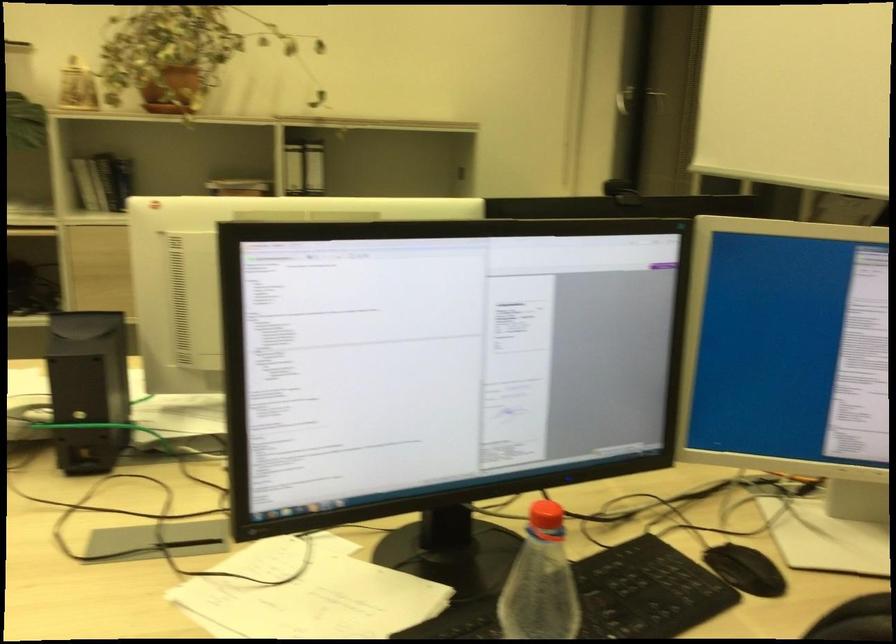
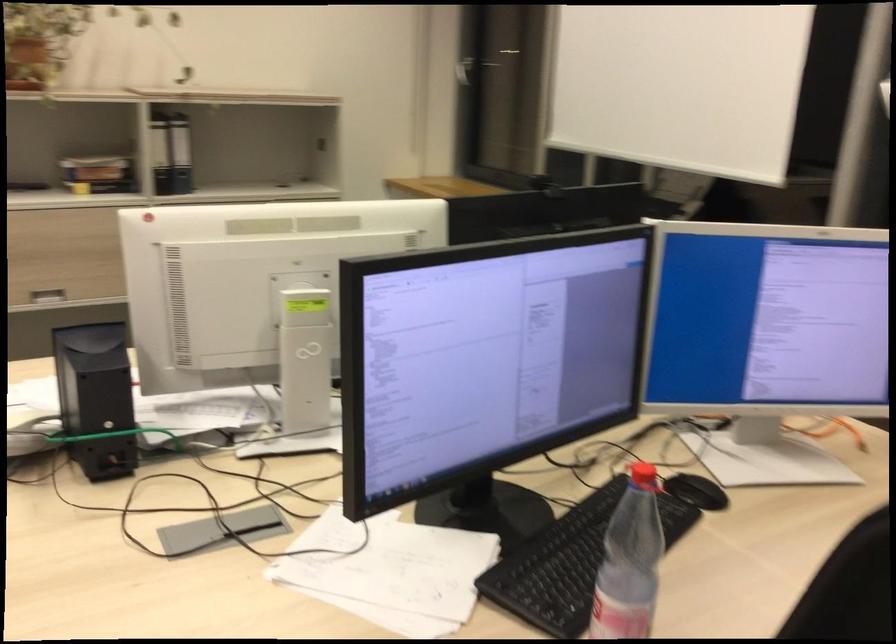
Where in the second image is the point corresponding to point (550, 522) from the first image?

(642, 478)